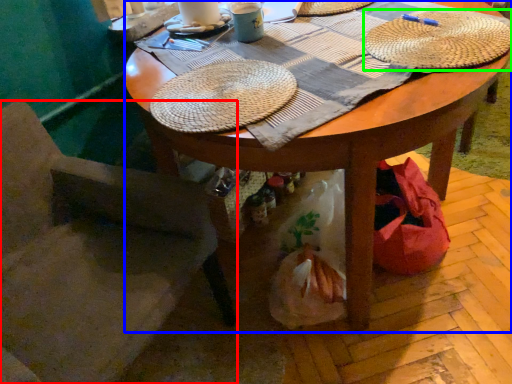
Question: Which object is the closest to the chair (highlighted by a red box)? Choose among these: desk (highlighted by a blue box) or hat (highlighted by a green box).

Choices:
 (A) desk
 (B) hat

Answer: (A)